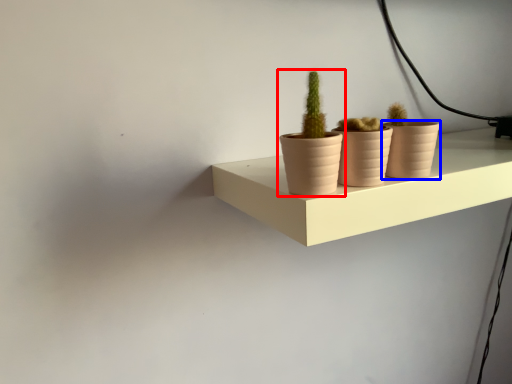
Question: Which of the following is the farthest to the observer, houseplant (highlighted by a red box) or flowerpot (highlighted by a blue box)?

Choices:
 (A) houseplant
 (B) flowerpot

Answer: (B)